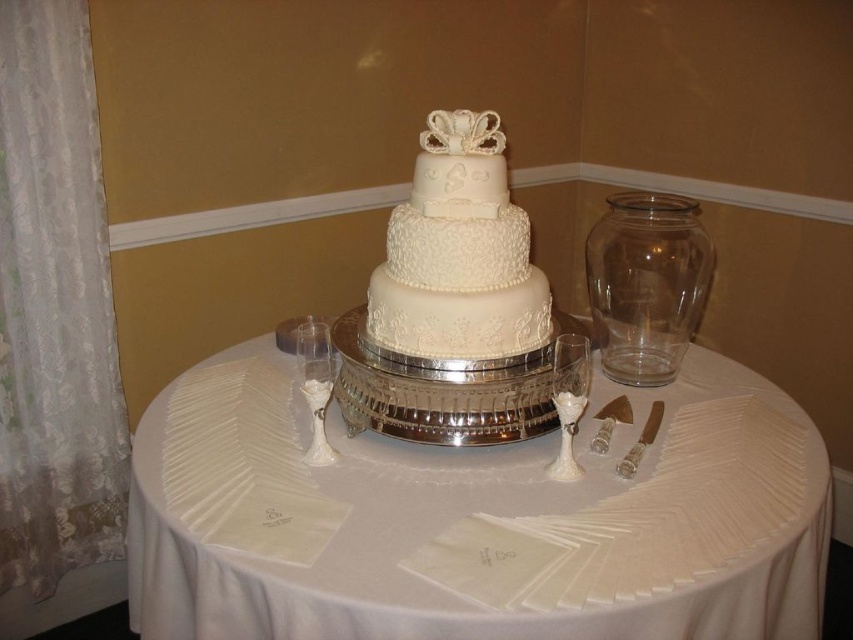
You are standing at the edge of the table where the wedding cake is placed. You see two points marked on the table surface at coordinates point (x=315, y=456) and point (x=613, y=410). Which point is closer to you as you face the cake?

Point (x=315, y=456) is in front of point (x=613, y=410), so it is closer to you as you face the cake.